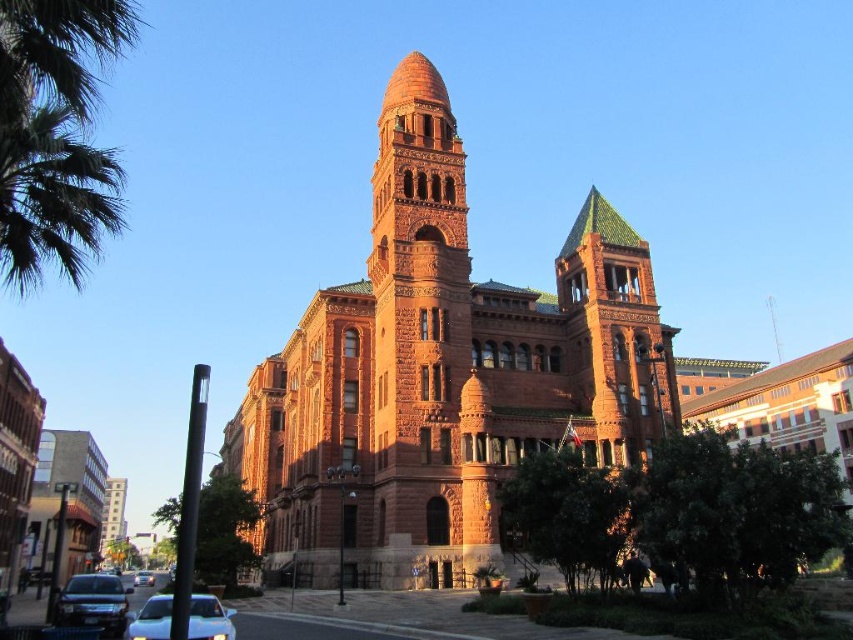
You are a photographer planning to capture both cars in a single frame. Given that the white glossy car at lower left is smaller than the white glossy car at center, which car should you position closer to the camera to make them appear the same size in the photo?

To make the white glossy car at lower left and the white glossy car at center appear the same size in the photo, you should position the smaller white glossy car at lower left closer to the camera since it is naturally smaller in size.

You are standing at the base of the grand historic building and see two points marked on the building facade. The first point is at coordinates point (207,634) and the second is at point (136,577). Which point is closer to you?

Point (207,634) is in front of point (136,577), so it is closer to you.